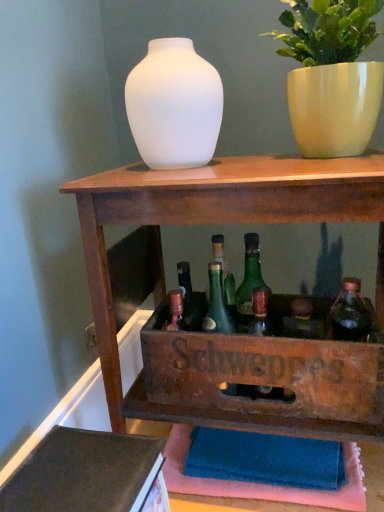
Question: Considering the relative sizes of translucent glass bottle at center-right, which is the first bottle from right to left, and wooden shelf at center in the image provided, is translucent glass bottle at center-right, which is the first bottle from right to left, taller than wooden shelf at center?

Choices:
 (A) yes
 (B) no

Answer: (B)

Question: Is translucent glass bottle at center-right, the second bottle viewed from the left, directly adjacent to wooden shelf at center?

Choices:
 (A) no
 (B) yes

Answer: (A)

Question: Could you tell me if translucent glass bottle at center-right, the second bottle viewed from the left, is turned towards wooden shelf at center?

Choices:
 (A) yes
 (B) no

Answer: (A)

Question: Considering the relative sizes of translucent glass bottle at center-right, which is the first bottle from right to left, and wooden shelf at center in the image provided, is translucent glass bottle at center-right, which is the first bottle from right to left, thinner than wooden shelf at center?

Choices:
 (A) yes
 (B) no

Answer: (A)

Question: Does translucent glass bottle at center-right, which is the first bottle from right to left, lie in front of wooden shelf at center?

Choices:
 (A) no
 (B) yes

Answer: (A)

Question: Does translucent glass bottle at center-right, which is the first bottle from right to left, lie behind wooden shelf at center?

Choices:
 (A) yes
 (B) no

Answer: (A)

Question: Does green glass bottle at center have a greater height compared to wooden shelf at center?

Choices:
 (A) yes
 (B) no

Answer: (B)

Question: Is green glass bottle at center next to wooden shelf at center and touching it?

Choices:
 (A) no
 (B) yes

Answer: (A)

Question: Is green glass bottle at center positioned with its back to wooden shelf at center?

Choices:
 (A) no
 (B) yes

Answer: (B)

Question: From a real-world perspective, is green glass bottle at center on top of wooden shelf at center?

Choices:
 (A) yes
 (B) no

Answer: (A)

Question: From the image's perspective, is green glass bottle at center located beneath wooden shelf at center?

Choices:
 (A) yes
 (B) no

Answer: (B)

Question: Is green glass bottle at center closer to camera compared to wooden shelf at center?

Choices:
 (A) yes
 (B) no

Answer: (B)

Question: Considering the relative sizes of frosted glass vase at center and white glossy pot at upper right in the image provided, is frosted glass vase at center thinner than white glossy pot at upper right?

Choices:
 (A) no
 (B) yes

Answer: (B)